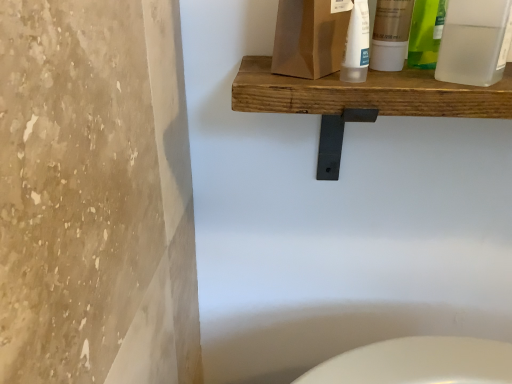
The width and height of the screenshot is (512, 384). What do you see at coordinates (362, 100) in the screenshot?
I see `wooden shelf at upper center` at bounding box center [362, 100].

You are a GUI agent. You are given a task and a screenshot of the screen. Output one action in this format:
    pyautogui.click(x=<x>, y=<y>)
    Task: Click on the matte white tube at upper center, acting as the 1th mouthwash starting from the left
    Image resolution: width=512 pixels, height=384 pixels.
    Given the screenshot: What is the action you would take?
    pyautogui.click(x=390, y=34)

What do you see at coordinates (475, 42) in the screenshot? This screenshot has height=384, width=512. I see `transparent plastic bottle at upper right, acting as the 1th mouthwash starting from the right` at bounding box center [475, 42].

What is the approximate width of transparent plastic bottle at upper right, which appears as the 2th mouthwash when viewed from the left?

transparent plastic bottle at upper right, which appears as the 2th mouthwash when viewed from the left, is 6.57 centimeters in width.

Measure the distance between point (329, 48) and camera.

Point (329, 48) is 55.90 centimeters from camera.

Describe the element at coordinates (308, 38) in the screenshot. The image size is (512, 384). I see `translucent plastic bottle at upper center, which ranks as the first cleaning product in left-to-right order` at that location.

This screenshot has height=384, width=512. In order to click on wooden shelf at upper center in this screenshot , I will do `click(362, 100)`.

Based on the photo, is translucent plastic tube at upper center, marked as the first cleaning product in a right-to-left arrangement, inside translucent plastic bottle at upper center, the second cleaning product positioned from the right?

No.

The image size is (512, 384). I want to click on cleaning product in front of the translucent plastic tube at upper center, the second cleaning product when ordered from left to right, so click(308, 38).

Considering the relative positions of translucent plastic bottle at upper center, which ranks as the first cleaning product in left-to-right order, and translucent plastic tube at upper center, marked as the first cleaning product in a right-to-left arrangement, in the image provided, is translucent plastic bottle at upper center, which ranks as the first cleaning product in left-to-right order, in front of translucent plastic tube at upper center, marked as the first cleaning product in a right-to-left arrangement,?

That is True.

Is translucent plastic bottle at upper center, which ranks as the first cleaning product in left-to-right order, taller or shorter than translucent plastic tube at upper center, the second cleaning product when ordered from left to right?

Considering their sizes, translucent plastic bottle at upper center, which ranks as the first cleaning product in left-to-right order, has more height than translucent plastic tube at upper center, the second cleaning product when ordered from left to right.

Would you say translucent plastic tube at upper center, marked as the first cleaning product in a right-to-left arrangement, is to the left or to the right of transparent plastic bottle at upper right, which appears as the 2th mouthwash when viewed from the left, in the picture?

In the image, translucent plastic tube at upper center, marked as the first cleaning product in a right-to-left arrangement, appears on the left side of transparent plastic bottle at upper right, which appears as the 2th mouthwash when viewed from the left.

Considering the sizes of objects translucent plastic tube at upper center, marked as the first cleaning product in a right-to-left arrangement, and transparent plastic bottle at upper right, which appears as the 2th mouthwash when viewed from the left, in the image provided, who is taller, translucent plastic tube at upper center, marked as the first cleaning product in a right-to-left arrangement, or transparent plastic bottle at upper right, which appears as the 2th mouthwash when viewed from the left,?

Standing taller between the two is transparent plastic bottle at upper right, which appears as the 2th mouthwash when viewed from the left.

Based on the photo, is translucent plastic tube at upper center, the second cleaning product when ordered from left to right, with transparent plastic bottle at upper right, acting as the 1th mouthwash starting from the right?

translucent plastic tube at upper center, the second cleaning product when ordered from left to right, and transparent plastic bottle at upper right, acting as the 1th mouthwash starting from the right, are not in contact.

Which is closer, [368,41] or [490,77]?

Point [368,41] is farther from the camera than point [490,77].

In the scene shown: Is matte white tube at upper center, marked as the second mouthwash in a right-to-left arrangement, next to wooden shelf at upper center?

No, matte white tube at upper center, marked as the second mouthwash in a right-to-left arrangement, is not with wooden shelf at upper center.

Based on the photo, is matte white tube at upper center, acting as the 1th mouthwash starting from the left, not within wooden shelf at upper center?

Yes, matte white tube at upper center, acting as the 1th mouthwash starting from the left, is not within wooden shelf at upper center.

Considering the points (401, 15) and (375, 107), which point is behind, point (401, 15) or point (375, 107)?

Point (401, 15)

Considering the sizes of matte white tube at upper center, marked as the second mouthwash in a right-to-left arrangement, and translucent plastic tube at upper center, the second cleaning product when ordered from left to right, in the image, is matte white tube at upper center, marked as the second mouthwash in a right-to-left arrangement, taller or shorter than translucent plastic tube at upper center, the second cleaning product when ordered from left to right,?

matte white tube at upper center, marked as the second mouthwash in a right-to-left arrangement, is taller than translucent plastic tube at upper center, the second cleaning product when ordered from left to right.

Considering the points (404, 1) and (361, 52), which point is in front, point (404, 1) or point (361, 52)?

Positioned in front is point (361, 52).

Would you say translucent plastic tube at upper center, the second cleaning product when ordered from left to right, is part of matte white tube at upper center, marked as the second mouthwash in a right-to-left arrangement,'s contents?

No, translucent plastic tube at upper center, the second cleaning product when ordered from left to right, is located outside of matte white tube at upper center, marked as the second mouthwash in a right-to-left arrangement.

In the image, is matte white tube at upper center, marked as the second mouthwash in a right-to-left arrangement, positioned in front of or behind translucent plastic tube at upper center, marked as the first cleaning product in a right-to-left arrangement?

Visually, matte white tube at upper center, marked as the second mouthwash in a right-to-left arrangement, is located behind translucent plastic tube at upper center, marked as the first cleaning product in a right-to-left arrangement.

Is matte white tube at upper center, acting as the 1th mouthwash starting from the left, facing towards transparent plastic bottle at upper right, which appears as the 2th mouthwash when viewed from the left?

No, matte white tube at upper center, acting as the 1th mouthwash starting from the left, is not turned towards transparent plastic bottle at upper right, which appears as the 2th mouthwash when viewed from the left.

Would you consider matte white tube at upper center, marked as the second mouthwash in a right-to-left arrangement, to be distant from transparent plastic bottle at upper right, which appears as the 2th mouthwash when viewed from the left?

Actually, matte white tube at upper center, marked as the second mouthwash in a right-to-left arrangement, and transparent plastic bottle at upper right, which appears as the 2th mouthwash when viewed from the left, are a little close together.

Consider the image. Which is closer to the camera, (401, 53) or (489, 27)?

Point (401, 53) is positioned farther from the camera compared to point (489, 27).

Who is shorter, wooden shelf at upper center or translucent plastic bottle at upper center, the second cleaning product positioned from the right?

With less height is wooden shelf at upper center.

Which is farther from the camera, (318, 177) or (308, 6)?

The point (318, 177) is farther from the camera.

How distant is wooden shelf at upper center from translucent plastic bottle at upper center, the second cleaning product positioned from the right?

3.77 inches.

Based on the photo, is translucent plastic bottle at upper center, which ranks as the first cleaning product in left-to-right order, at the back of wooden shelf at upper center?

No, translucent plastic bottle at upper center, which ranks as the first cleaning product in left-to-right order, is not at the back of wooden shelf at upper center.

Consider the image. From the image's perspective, is matte white tube at upper center, marked as the second mouthwash in a right-to-left arrangement, beneath translucent plastic bottle at upper center, the second cleaning product positioned from the right?

Correct, matte white tube at upper center, marked as the second mouthwash in a right-to-left arrangement, appears lower than translucent plastic bottle at upper center, the second cleaning product positioned from the right, in the image.

You are a GUI agent. You are given a task and a screenshot of the screen. Output one action in this format:
    pyautogui.click(x=<x>, y=<y>)
    Task: Click on the mouthwash lying behind the translucent plastic bottle at upper center, which ranks as the first cleaning product in left-to-right order
    This screenshot has height=384, width=512.
    Given the screenshot: What is the action you would take?
    pyautogui.click(x=390, y=34)

Does matte white tube at upper center, acting as the 1th mouthwash starting from the left, have a larger size compared to translucent plastic bottle at upper center, which ranks as the first cleaning product in left-to-right order?

Actually, matte white tube at upper center, acting as the 1th mouthwash starting from the left, might be smaller than translucent plastic bottle at upper center, which ranks as the first cleaning product in left-to-right order.

Based on their positions, is matte white tube at upper center, marked as the second mouthwash in a right-to-left arrangement, located to the left or right of translucent plastic bottle at upper center, which ranks as the first cleaning product in left-to-right order?

Based on their positions, matte white tube at upper center, marked as the second mouthwash in a right-to-left arrangement, is located to the right of translucent plastic bottle at upper center, which ranks as the first cleaning product in left-to-right order.

This screenshot has height=384, width=512. I want to click on cleaning product below the translucent plastic bottle at upper center, which ranks as the first cleaning product in left-to-right order (from the image's perspective), so click(x=356, y=45).

Locate an element on the screen. The image size is (512, 384). the 2nd cleaning product behind when counting from the transparent plastic bottle at upper right, acting as the 1th mouthwash starting from the right is located at coordinates (356, 45).

Looking at this image, looking at the image, which one is located closer to translucent plastic bottle at upper center, the second cleaning product positioned from the right, matte white tube at upper center, marked as the second mouthwash in a right-to-left arrangement, or transparent plastic bottle at upper right, acting as the 1th mouthwash starting from the right?

Among the two, matte white tube at upper center, marked as the second mouthwash in a right-to-left arrangement, is located nearer to translucent plastic bottle at upper center, the second cleaning product positioned from the right.

From the image, which object appears to be farther from translucent plastic bottle at upper center, the second cleaning product positioned from the right, wooden shelf at upper center or matte white tube at upper center, acting as the 1th mouthwash starting from the left?

wooden shelf at upper center.

Considering their positions, is translucent plastic bottle at upper center, the second cleaning product positioned from the right, positioned further to wooden shelf at upper center than matte white tube at upper center, marked as the second mouthwash in a right-to-left arrangement?

The object further to wooden shelf at upper center is matte white tube at upper center, marked as the second mouthwash in a right-to-left arrangement.

From the image, which object appears to be nearer to translucent plastic bottle at upper center, which ranks as the first cleaning product in left-to-right order, matte white tube at upper center, marked as the second mouthwash in a right-to-left arrangement, or wooden shelf at upper center?

Among the two, matte white tube at upper center, marked as the second mouthwash in a right-to-left arrangement, is located nearer to translucent plastic bottle at upper center, which ranks as the first cleaning product in left-to-right order.

Looking at the image, which one is located further to transparent plastic bottle at upper right, acting as the 1th mouthwash starting from the right, translucent plastic bottle at upper center, the second cleaning product positioned from the right, or translucent plastic tube at upper center, marked as the first cleaning product in a right-to-left arrangement?

translucent plastic bottle at upper center, the second cleaning product positioned from the right.

Estimate the real-world distances between objects in this image. Which object is further from wooden shelf at upper center, translucent plastic tube at upper center, marked as the first cleaning product in a right-to-left arrangement, or transparent plastic bottle at upper right, which appears as the 2th mouthwash when viewed from the left?

Among the two, transparent plastic bottle at upper right, which appears as the 2th mouthwash when viewed from the left, is located further to wooden shelf at upper center.

Which object lies nearer to the anchor point matte white tube at upper center, acting as the 1th mouthwash starting from the left, wooden shelf at upper center or translucent plastic bottle at upper center, the second cleaning product positioned from the right?

translucent plastic bottle at upper center, the second cleaning product positioned from the right, is closer to matte white tube at upper center, acting as the 1th mouthwash starting from the left.

Looking at the image, which one is located further to matte white tube at upper center, marked as the second mouthwash in a right-to-left arrangement, transparent plastic bottle at upper right, acting as the 1th mouthwash starting from the right, or wooden shelf at upper center?

wooden shelf at upper center lies further to matte white tube at upper center, marked as the second mouthwash in a right-to-left arrangement, than the other object.

In order to click on shelf between translucent plastic tube at upper center, marked as the first cleaning product in a right-to-left arrangement, and transparent plastic bottle at upper right, acting as the 1th mouthwash starting from the right, in the horizontal direction in this screenshot , I will do `click(362, 100)`.

The width and height of the screenshot is (512, 384). I want to click on cleaning product situated between translucent plastic bottle at upper center, the second cleaning product positioned from the right, and matte white tube at upper center, acting as the 1th mouthwash starting from the left, from left to right, so pyautogui.click(x=356, y=45).

This screenshot has width=512, height=384. I want to click on mouthwash between matte white tube at upper center, marked as the second mouthwash in a right-to-left arrangement, and wooden shelf at upper center, in the vertical direction, so click(x=475, y=42).

Where is `cleaning product between translucent plastic bottle at upper center, the second cleaning product positioned from the right, and wooden shelf at upper center, in the vertical direction`? cleaning product between translucent plastic bottle at upper center, the second cleaning product positioned from the right, and wooden shelf at upper center, in the vertical direction is located at coordinates (356, 45).